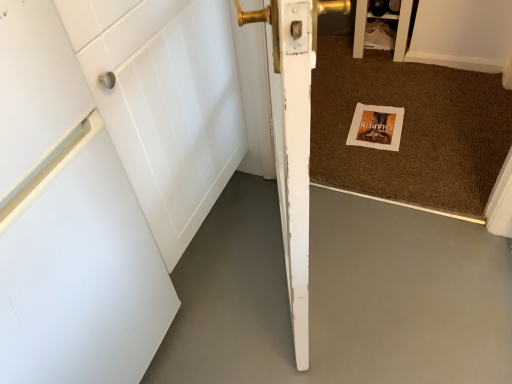
Question: Is white paper postcard at center smaller than gold metallic door handle at upper center?

Choices:
 (A) no
 (B) yes

Answer: (B)

Question: Is the depth of white paper postcard at center greater than that of gold metallic door handle at upper center?

Choices:
 (A) no
 (B) yes

Answer: (A)

Question: Considering the relative sizes of white paper postcard at center and gold metallic door handle at upper center in the image provided, is white paper postcard at center shorter than gold metallic door handle at upper center?

Choices:
 (A) no
 (B) yes

Answer: (B)

Question: Is white paper postcard at center next to gold metallic door handle at upper center?

Choices:
 (A) yes
 (B) no

Answer: (B)

Question: Is gold metallic door handle at upper center located within white paper postcard at center?

Choices:
 (A) no
 (B) yes

Answer: (A)

Question: Is point (406, 13) positioned closer to the camera than point (322, 13)?

Choices:
 (A) farther
 (B) closer

Answer: (B)

Question: From the image's perspective, is matte white cabinet at upper right located above or below gold metallic door handle at upper center?

Choices:
 (A) below
 (B) above

Answer: (A)

Question: In the image, is matte white cabinet at upper right positioned in front of or behind gold metallic door handle at upper center?

Choices:
 (A) behind
 (B) front

Answer: (B)

Question: Is matte white cabinet at upper right to the left or to the right of gold metallic door handle at upper center in the image?

Choices:
 (A) left
 (B) right

Answer: (B)

Question: Considering the positions of brown woven mat at center and white matte concrete at lower left in the image, is brown woven mat at center bigger or smaller than white matte concrete at lower left?

Choices:
 (A) small
 (B) big

Answer: (B)

Question: Considering their positions, is brown woven mat at center located in front of or behind white matte concrete at lower left?

Choices:
 (A) behind
 (B) front

Answer: (A)

Question: Considering the positions of point (x=468, y=180) and point (x=180, y=334), is point (x=468, y=180) closer or farther from the camera than point (x=180, y=334)?

Choices:
 (A) farther
 (B) closer

Answer: (A)

Question: From a real-world perspective, is brown woven mat at center above or below white matte concrete at lower left?

Choices:
 (A) above
 (B) below

Answer: (A)

Question: Looking at the image, does white matte door at center seem bigger or smaller compared to white matte concrete at lower left?

Choices:
 (A) small
 (B) big

Answer: (B)

Question: Is white matte door at center inside or outside of white matte concrete at lower left?

Choices:
 (A) outside
 (B) inside

Answer: (A)